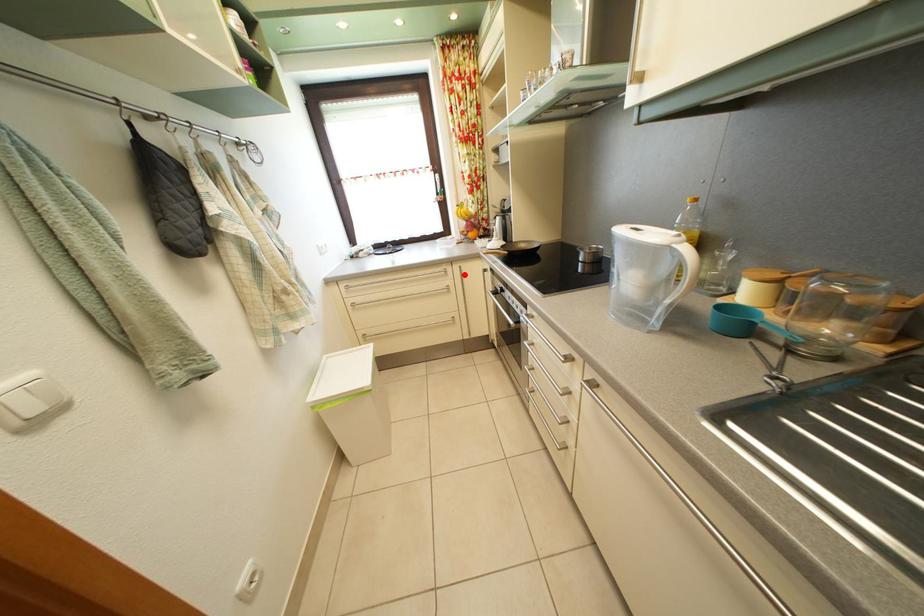
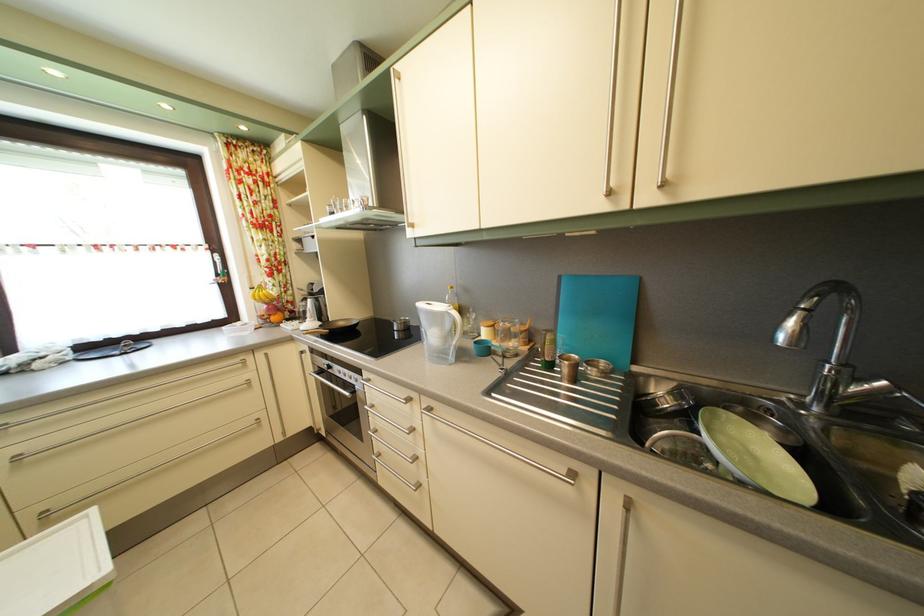
Locate, in the second image, the point that corresponds to the highlighted location in the first image.

(268, 363)